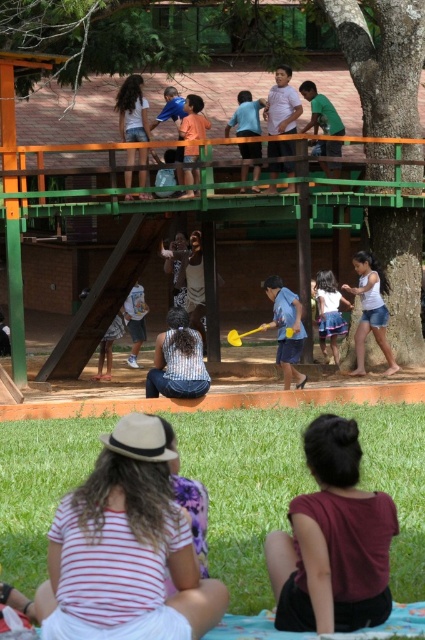
You are standing in the park and see the green rough bark tree at upper center and the striped shirt at center. Which object is higher in the image?

The green rough bark tree at upper center is positioned over the striped shirt at center, so it is higher in the image.

You are standing at the center of the park and see both the green rough bark tree at center and the blue denim skirt at center. If you want to reach the tree first, which direction should you walk towards?

The green rough bark tree at center is closer to you than the blue denim skirt at center since the distance between them is 12.60 feet. Therefore, you should walk towards the green rough bark tree at center to reach it first.